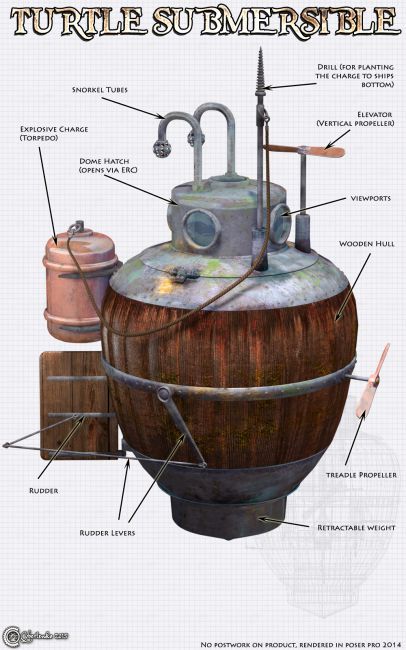
Identify the location of wood barrel. The width and height of the screenshot is (406, 650). 244,450.